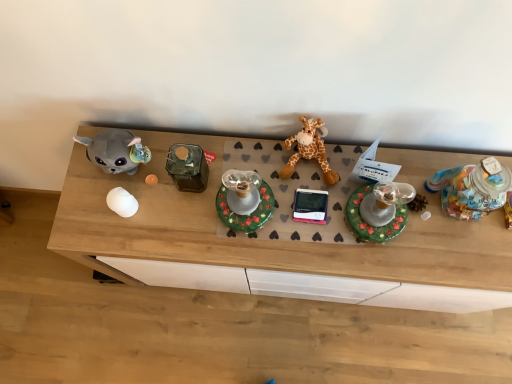
Identify the location of unoccupied region to the right of green matte candle holder at center, placed as the second toy when sorted from left to right. This screenshot has height=384, width=512. (301, 224).